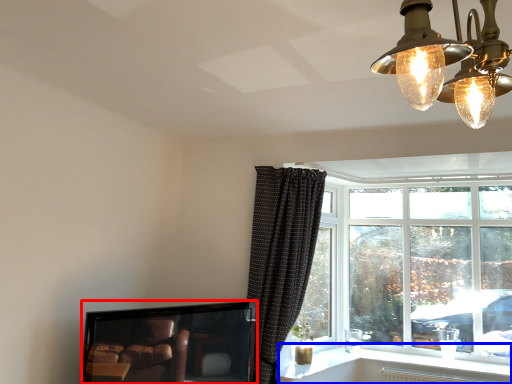
Question: Which object appears farthest to the camera in this image, television (highlighted by a red box) or window sill (highlighted by a blue box)?

Choices:
 (A) television
 (B) window sill

Answer: (B)